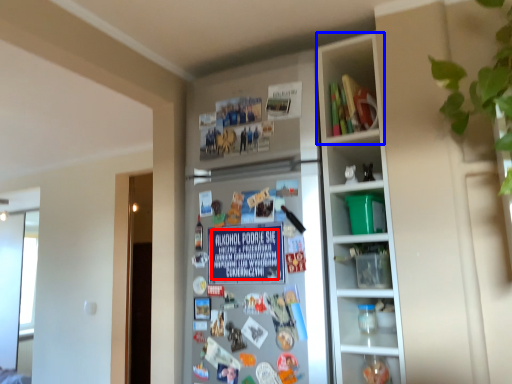
Question: Which point is closer to the camera, writing (highlighted by a red box) or cabinet (highlighted by a blue box)?

Choices:
 (A) writing
 (B) cabinet

Answer: (A)